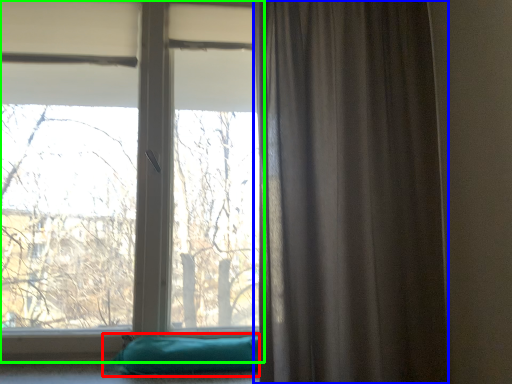
Question: Which object is the closest to the pillow (highlighted by a red box)? Choose among these: curtain (highlighted by a blue box) or window (highlighted by a green box).

Choices:
 (A) curtain
 (B) window

Answer: (A)